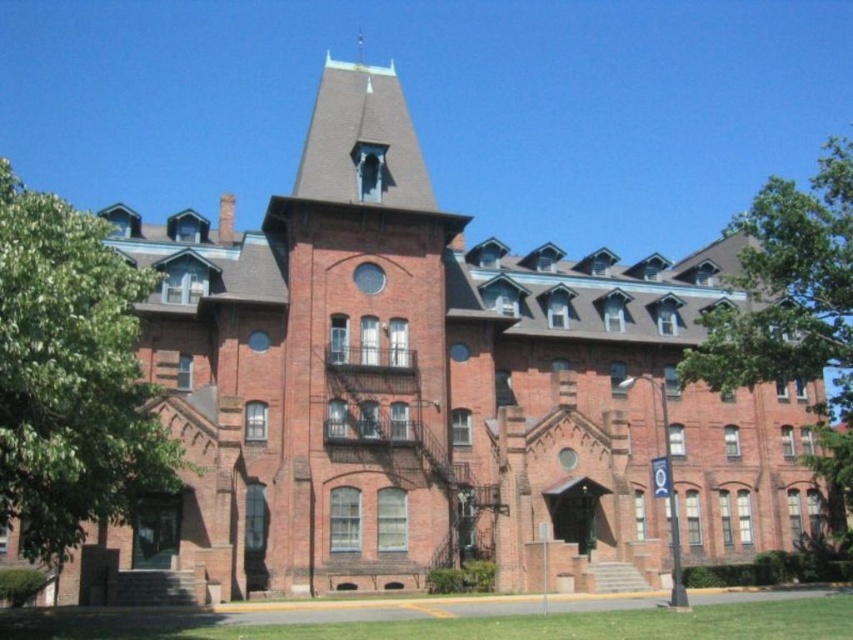
Can you confirm if green leafy tree at left is positioned above green leafy tree at right?

Incorrect, green leafy tree at left is not positioned above green leafy tree at right.

Is green leafy tree at left below green leafy tree at right?

Yes.

Does point (126, 305) come in front of point (825, 225)?

That is True.

The image size is (853, 640). Identify the location of green leafy tree at left. (71, 378).